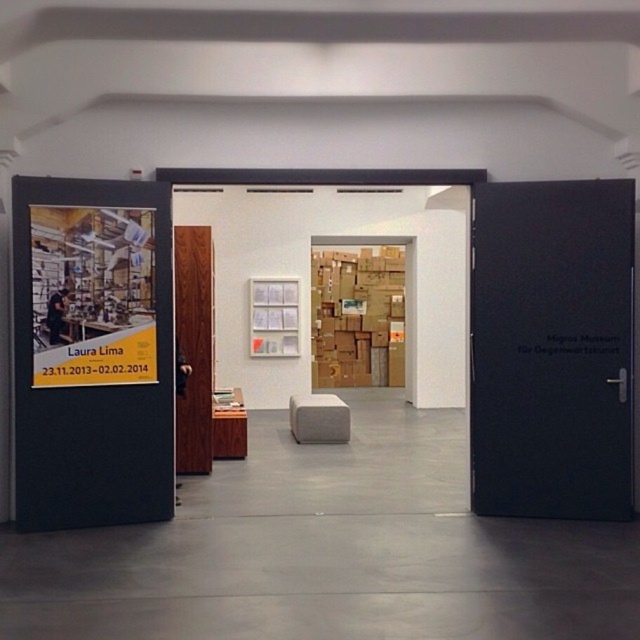
Which is more to the left, matte black poster at left or beige fabric stool at center?

From the viewer's perspective, matte black poster at left appears more on the left side.

Which is behind, point (116, 324) or point (330, 422)?

The point (330, 422) is more distant.

Who is more forward, (115, 316) or (339, 417)?

Point (115, 316) is more forward.

You are a GUI agent. You are given a task and a screenshot of the screen. Output one action in this format:
    pyautogui.click(x=<x>, y=<y>)
    Task: Click on the matte black poster at left
    This screenshot has height=640, width=640.
    Given the screenshot: What is the action you would take?
    pyautogui.click(x=92, y=296)

Can you confirm if black matte door at right is thinner than matte black poster at left?

No.

Image resolution: width=640 pixels, height=640 pixels. I want to click on black matte door at right, so click(552, 348).

Is point (604, 330) closer to viewer compared to point (118, 240)?

No, it is behind (118, 240).

In order to click on black matte door at right in this screenshot , I will do `click(552, 348)`.

This screenshot has height=640, width=640. Describe the element at coordinates (193, 346) in the screenshot. I see `wooden door at center` at that location.

Is wooden door at center taller than beige fabric stool at center?

Indeed, wooden door at center has a greater height compared to beige fabric stool at center.

Between point (209, 240) and point (333, 412), which one is positioned in front?

Point (209, 240) is more forward.

The width and height of the screenshot is (640, 640). I want to click on wooden door at center, so click(193, 346).